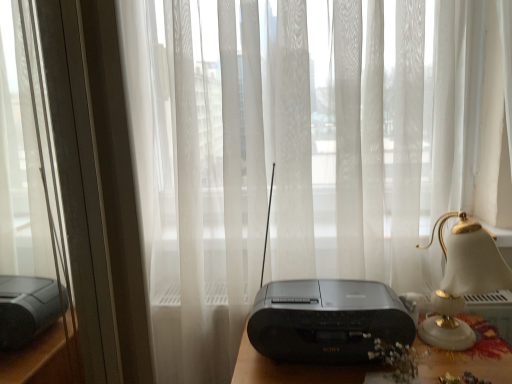
This screenshot has width=512, height=384. I want to click on metallic silver window frame at left, so click(57, 182).

This screenshot has width=512, height=384. Describe the element at coordinates (463, 280) in the screenshot. I see `white glossy bedside lamp at right` at that location.

This screenshot has height=384, width=512. In order to click on black plastic radio at center in this screenshot , I will do `click(325, 317)`.

The image size is (512, 384). What do you see at coordinates (326, 320) in the screenshot? I see `black plastic radio at center` at bounding box center [326, 320].

The width and height of the screenshot is (512, 384). In order to click on metallic silver window frame at left in this screenshot , I will do `click(57, 182)`.

I want to click on printer that is on the right side of metallic silver window frame at left, so click(x=326, y=320).

Considering the positions of objects metallic silver window frame at left and black plastic radio at center in the image provided, who is more to the left, metallic silver window frame at left or black plastic radio at center?

Positioned to the left is metallic silver window frame at left.

Is metallic silver window frame at left far away from black plastic radio at center?

metallic silver window frame at left is near black plastic radio at center, not far away.

Is point (29, 49) less distant than point (350, 318)?

Yes, point (29, 49) is in front of point (350, 318).

I want to click on gadget located above the metallic silver window frame at left (from a real-world perspective), so click(x=325, y=317).

Is there a large distance between metallic silver window frame at left and black plastic radio at center?

No, metallic silver window frame at left is not far away from black plastic radio at center.

Can you confirm if metallic silver window frame at left is positioned to the left of black plastic radio at center?

Correct, you'll find metallic silver window frame at left to the left of black plastic radio at center.

Are black plastic radio at center and white glossy bedside lamp at right making contact?

They are not placed beside each other.

From the image's perspective, would you say black plastic radio at center is positioned over white glossy bedside lamp at right?

No, from the image's perspective, black plastic radio at center is not over white glossy bedside lamp at right.

Is black plastic radio at center facing towards white glossy bedside lamp at right?

No.

From a real-world perspective, is black plastic radio at center on top of white glossy bedside lamp at right?

Incorrect, from a real-world perspective, black plastic radio at center is lower than white glossy bedside lamp at right.

Based on the photo, is there a large distance between black plastic radio at center and metallic silver window frame at left?

No.

Is black plastic radio at center inside the boundaries of metallic silver window frame at left, or outside?

black plastic radio at center is not enclosed by metallic silver window frame at left.

Locate an element on the screen. printer that is in front of the metallic silver window frame at left is located at coordinates (326, 320).

Which of these two, black plastic radio at center or metallic silver window frame at left, is thinner?

Thinner between the two is black plastic radio at center.

Does black plastic radio at center have a greater height compared to white glossy bedside lamp at right?

Yes, black plastic radio at center is taller than white glossy bedside lamp at right.

Is black plastic radio at center further to the viewer compared to white glossy bedside lamp at right?

No, black plastic radio at center is closer to the viewer.

Choose the correct answer: Is black plastic radio at center inside white glossy bedside lamp at right or outside it?

black plastic radio at center is spatially situated outside white glossy bedside lamp at right.

Is black plastic radio at center oriented towards white glossy bedside lamp at right?

No, black plastic radio at center does not turn towards white glossy bedside lamp at right.

Does point (441, 286) lie in front of point (293, 347)?

No, it is not.

Considering the relative sizes of white glossy bedside lamp at right and black plastic radio at center in the image provided, is white glossy bedside lamp at right bigger than black plastic radio at center?

Yes.

I want to click on printer behind the white glossy bedside lamp at right, so tap(326, 320).

From the picture: From the image's perspective, between white glossy bedside lamp at right and black plastic radio at center, which one is located above?

white glossy bedside lamp at right.

Does black plastic radio at center come in front of black plastic radio at center?

No, black plastic radio at center is further to the viewer.

Measure the distance between black plastic radio at center and black plastic radio at center.

0.23 inches.

Is black plastic radio at center not close to black plastic radio at center?

black plastic radio at center is actually quite close to black plastic radio at center.

This screenshot has width=512, height=384. I want to click on window frame that appears above the black plastic radio at center (from the image's perspective), so click(57, 182).

The width and height of the screenshot is (512, 384). What are the coordinates of `window frame that is under the black plastic radio at center (from a real-world perspective)` in the screenshot? It's located at (57, 182).

Which object lies nearer to the anchor point metallic silver window frame at left, black plastic radio at center or black plastic radio at center?

black plastic radio at center is closer to metallic silver window frame at left.

Looking at the image, which one is located further to black plastic radio at center, black plastic radio at center or metallic silver window frame at left?

Based on the image, metallic silver window frame at left appears to be further to black plastic radio at center.

Looking at this image, when comparing their distances from white glossy bedside lamp at right, does black plastic radio at center or metallic silver window frame at left seem further?

metallic silver window frame at left lies further to white glossy bedside lamp at right than the other object.

When comparing their distances from black plastic radio at center, does metallic silver window frame at left or black plastic radio at center seem closer?

black plastic radio at center.

Considering their positions, is black plastic radio at center positioned further to metallic silver window frame at left than white glossy bedside lamp at right?

white glossy bedside lamp at right lies further to metallic silver window frame at left than the other object.

Based on their spatial positions, is black plastic radio at center or metallic silver window frame at left further from black plastic radio at center?

metallic silver window frame at left is positioned further to the anchor black plastic radio at center.

From the image, which object appears to be nearer to metallic silver window frame at left, white glossy bedside lamp at right or black plastic radio at center?

black plastic radio at center is positioned closer to the anchor metallic silver window frame at left.

When comparing their distances from metallic silver window frame at left, does black plastic radio at center or white glossy bedside lamp at right seem closer?

Based on the image, black plastic radio at center appears to be nearer to metallic silver window frame at left.

Identify the location of printer between metallic silver window frame at left and black plastic radio at center. This screenshot has width=512, height=384. (326, 320).

In order to click on gadget located between metallic silver window frame at left and white glossy bedside lamp at right in the left-right direction in this screenshot , I will do `click(325, 317)`.

Identify the location of gadget between black plastic radio at center and white glossy bedside lamp at right in the horizontal direction. (325, 317).

This screenshot has width=512, height=384. Identify the location of printer between metallic silver window frame at left and white glossy bedside lamp at right. (326, 320).